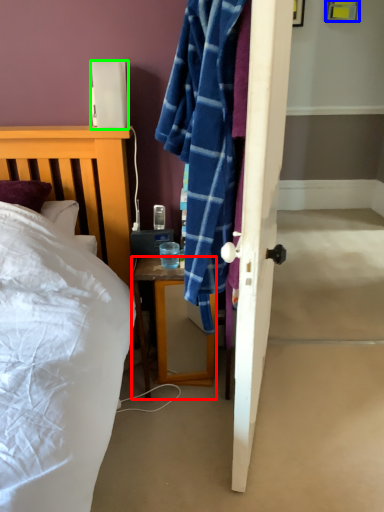
Question: Considering the real-world distances, which object is farthest from desk (highlighted by a red box)? picture frame (highlighted by a blue box) or lamp (highlighted by a green box)?

Choices:
 (A) picture frame
 (B) lamp

Answer: (A)